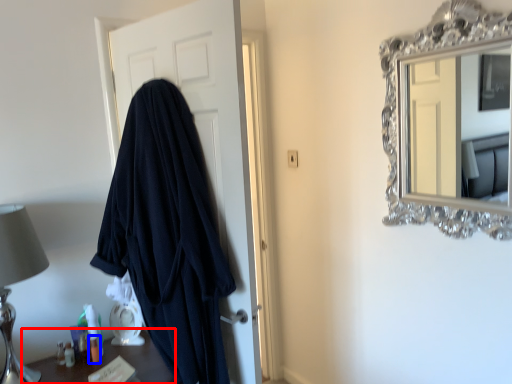
Question: Which point is closer to the camera, furniture (highlighted by a red box) or toiletry (highlighted by a blue box)?

Choices:
 (A) furniture
 (B) toiletry

Answer: (A)